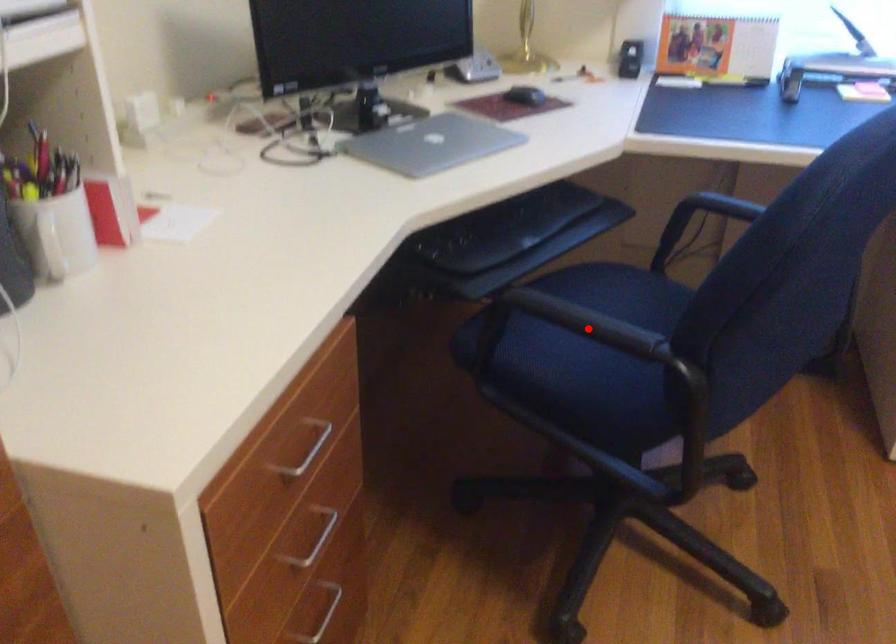
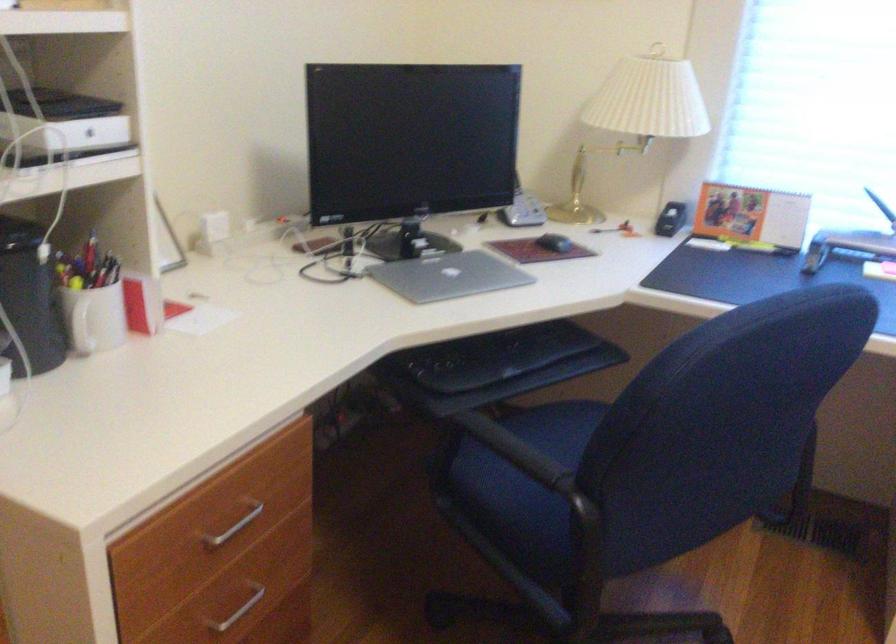
Where in the second image is the point corresponding to the highlighted location from the first image?

(513, 450)